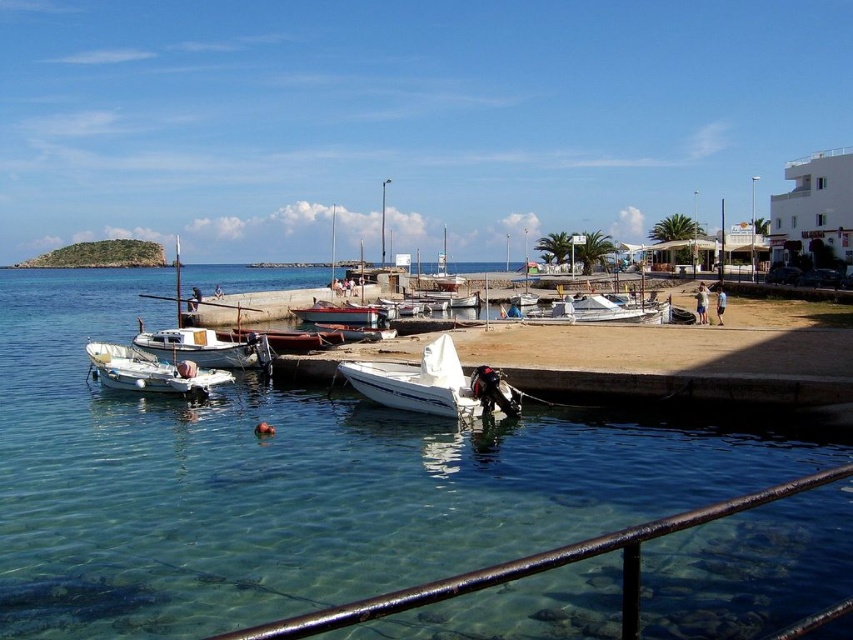
Does rusty metal railing at lower center appear under white matte boat at lower left?

Incorrect, rusty metal railing at lower center is not positioned below white matte boat at lower left.

Is rusty metal railing at lower center above white matte boat at lower left?

Yes, rusty metal railing at lower center is above white matte boat at lower left.

This screenshot has height=640, width=853. What are the coordinates of `rusty metal railing at lower center` in the screenshot? It's located at (x=537, y=568).

This screenshot has width=853, height=640. Find the location of `rusty metal railing at lower center`. rusty metal railing at lower center is located at coordinates (537, 568).

What do you see at coordinates (434, 385) in the screenshot? The width and height of the screenshot is (853, 640). I see `white matte motorboat at center` at bounding box center [434, 385].

Locate an element on the screen. This screenshot has height=640, width=853. white matte motorboat at center is located at coordinates (434, 385).

Locate an element on the screen. Image resolution: width=853 pixels, height=640 pixels. white matte motorboat at center is located at coordinates (434, 385).

Can you confirm if wooden boat at center is positioned to the right of metallic silver boat at center?

Incorrect, wooden boat at center is not on the right side of metallic silver boat at center.

Is point (316, 348) positioned in front of point (343, 320)?

Yes, it is in front of point (343, 320).

Does point (321, 344) come farther from viewer compared to point (300, 316)?

No, it is not.

Locate an element on the screen. wooden boat at center is located at coordinates (285, 339).